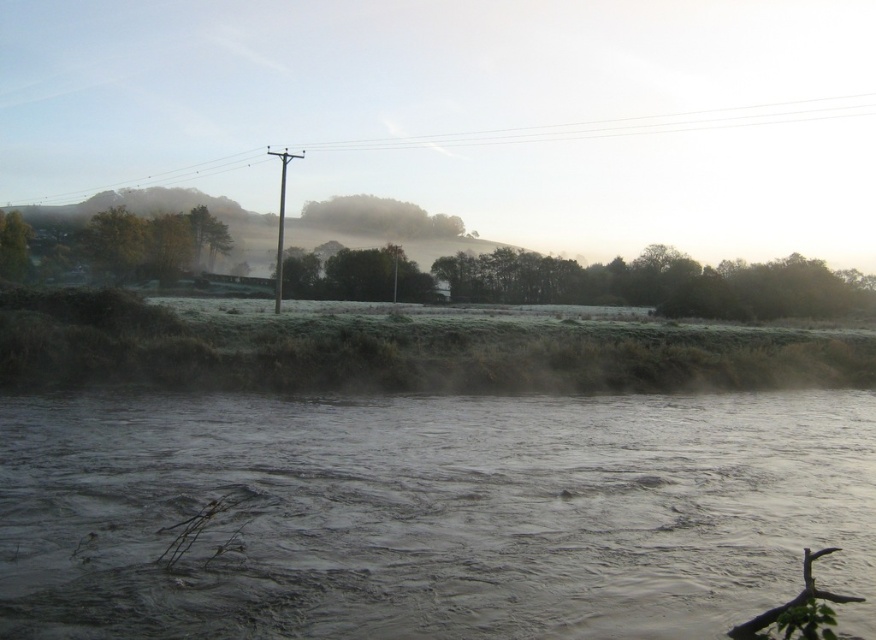
Question: Which of these objects is positioned closest to the gray murky water at center?

Choices:
 (A) green matte tree at center
 (B) green matte tree at left
 (C) metallic gray telegraph pole at center

Answer: (C)

Question: Can you confirm if smooth wood pole at upper center is wider than green matte tree at center?

Choices:
 (A) no
 (B) yes

Answer: (B)

Question: From the image, what is the correct spatial relationship of green matte tree at center in relation to green matte tree at left?

Choices:
 (A) below
 (B) above

Answer: (B)

Question: Which of the following is the farthest from the observer?

Choices:
 (A) green matte tree at center
 (B) gray murky water at center

Answer: (A)

Question: Is smooth wood pole at upper center bigger than metallic gray telegraph pole at center?

Choices:
 (A) yes
 (B) no

Answer: (B)

Question: Which object appears closest to the camera in this image?

Choices:
 (A) smooth wood pole at upper center
 (B) green matte tree at center
 (C) metallic gray telegraph pole at center
 (D) green matte tree at left

Answer: (C)